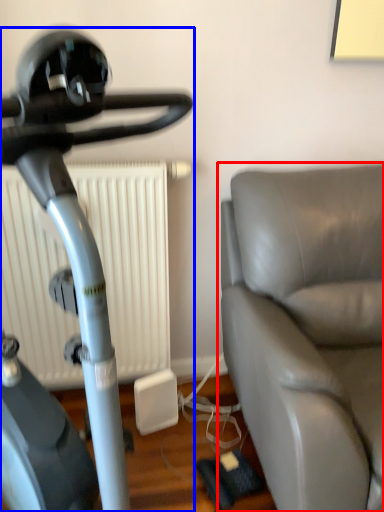
Question: Which object appears farthest to the camera in this image, studio couch (highlighted by a red box) or stationary bicycle (highlighted by a blue box)?

Choices:
 (A) studio couch
 (B) stationary bicycle

Answer: (A)